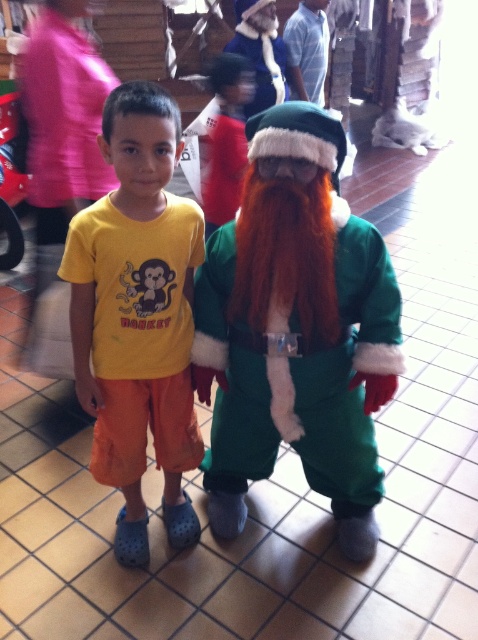
You are a photographer standing 1.5 meters away from the camera. You want to take a photo of the green fuzzy santa at center. Can you reach the camera to adjust it?

The camera and the green fuzzy santa at center are 1.22 meters apart. Since you are 1.5 meters away from the camera, you are 2.72 meters away from the green fuzzy santa at center. Therefore, you can reach the camera to adjust it as you are close enough.

You are a photographer standing at the camera position. You want to place a small sticker exactly at the point marked as point (248,348). The sticker has a diameter of 0.3 meters. Will the sticker fit entirely within the frame of the image?

The point (248,348) is 1.45 meters away from the camera. Since the sticker has a diameter of 0.3 meters, it can fit entirely within the frame as long as the camera lens can capture objects at that distance and the sticker is placed precisely at that point without exceeding the frame boundaries. However, the provided information does not specify the camera lens specifications or frame dimensions, so we cannot definitively confirm the fit based solely on the given data.